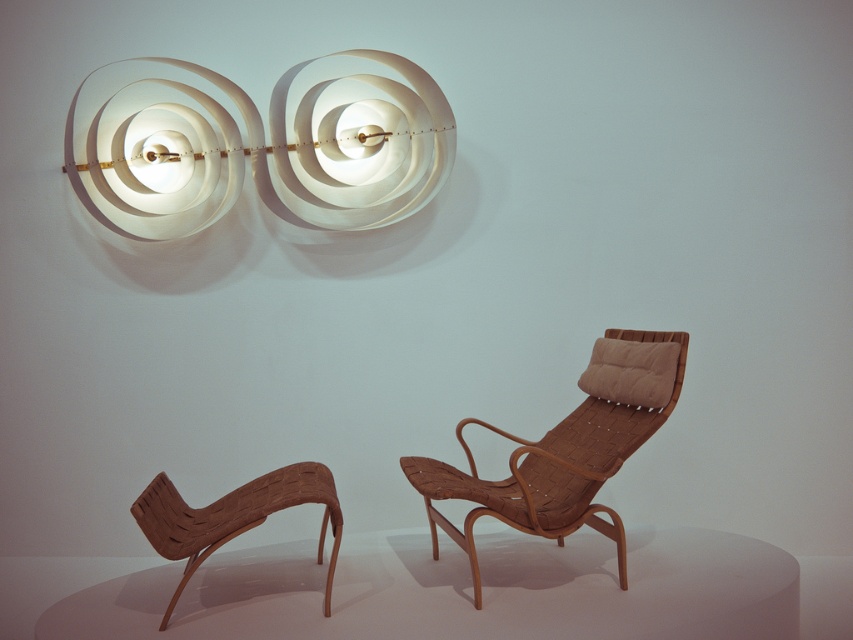
You are a delivery person trying to place a large package between the brown woven wood armchair at center and the brown woven armchair at lower left. The package is 24 inches wide. Will there be enough space to fit it between them?

The distance between the brown woven wood armchair at center and the brown woven armchair at lower left is 25.63 inches. Since the package is 24 inches wide, there is enough space to fit it between them.

You are standing in the room and want to reach the white paper lamp at upper center. If your arm can extend 1.5 meters, can you touch the lamp without moving closer?

The white paper lamp at upper center is 3.44 meters away from you, which is farther than your arm can reach. You cannot touch it without moving closer.

You are standing in the room and notice a point marked at coordinates [566,449]. Which object is located at this point?

The point at coordinates [566,449] corresponds to the brown woven wood armchair at center.